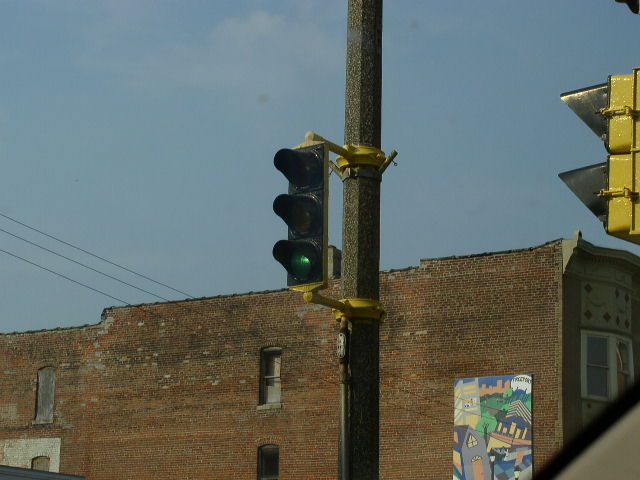
Image resolution: width=640 pixels, height=480 pixels. I want to click on artwork, so click(483, 428).